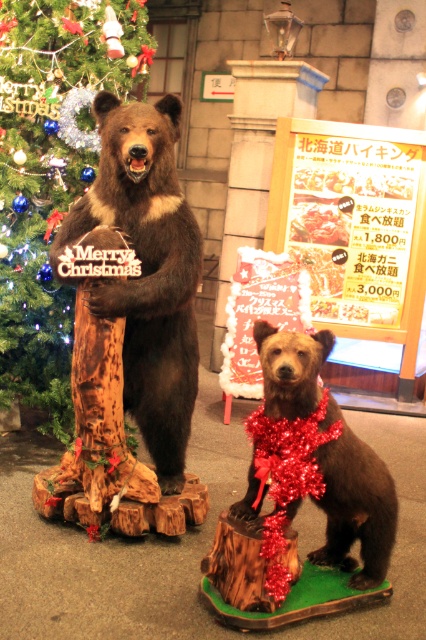
Consider the image. You are a delivery robot that needs to place a gift box between the shiny brown bear at center and the shiny red tinsel at center. The gift box is 30 inches long. Will the gift box fit in the space between them?

The distance between the shiny brown bear at center and the shiny red tinsel at center is 28.74 inches. Since the gift box is 30 inches long, it will not fit in the space between them.

You are standing in front of the two bear sculptures and want to take a photo that captures both bears clearly. Since you need to ensure you are far enough away to include both in the frame, can you determine if the distance from your current position to the point marked by coordinates point (14, 8) is within a 3 meter range?

The point (14, 8) is 2.97 meters away from camera, so yes, the distance is within 3 meters, meaning you can take the photo from your current position.

You are standing in front of the two bear sculptures and want to place a small ornament. You have two points marked on the image where you can place it. Which point is closer to you, point [23,218] or point [100,132]?

Point [23,218] is closer to you than point [100,132] because it is further to the viewer.